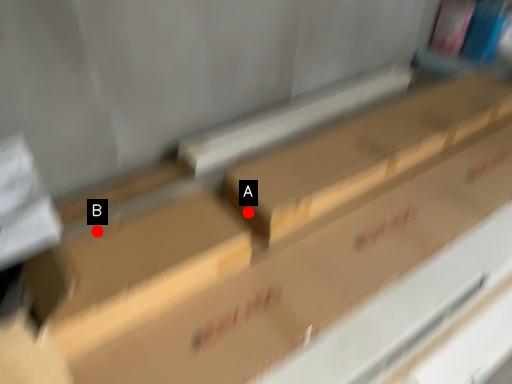
Question: Two points are circled on the image, labeled by A and B beside each circle. Which point is farther to the camera?

Choices:
 (A) A is further
 (B) B is further

Answer: (A)